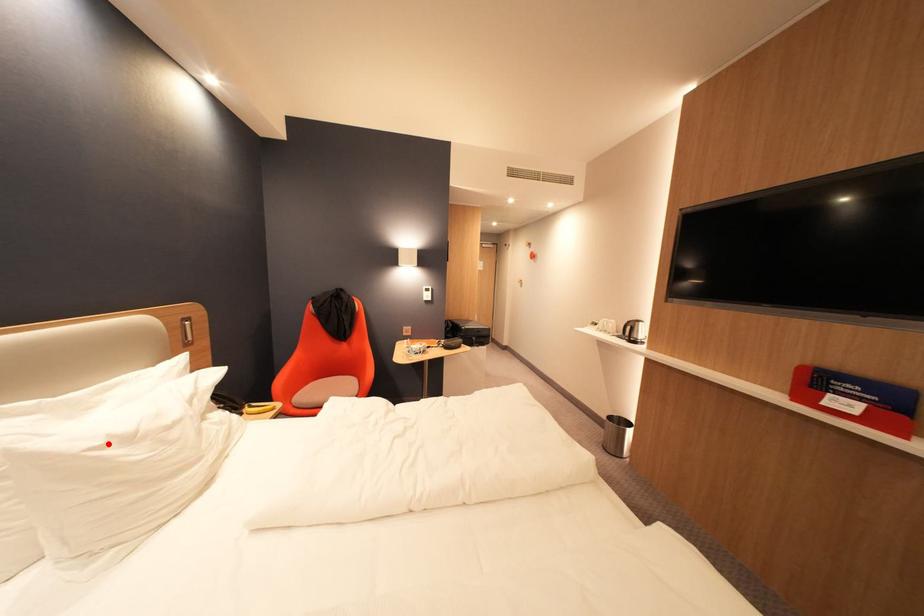
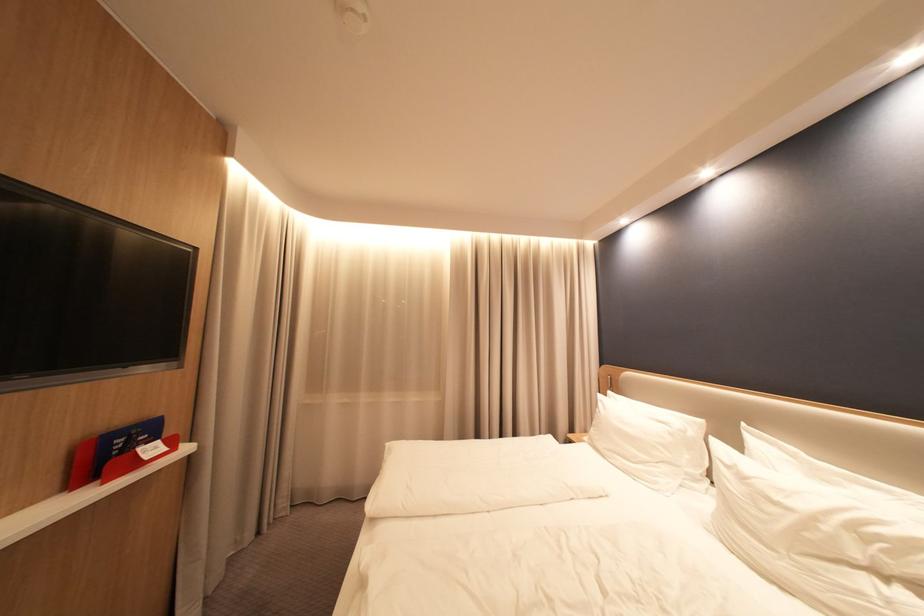
Where in the second image is the point corresponding to the highlighted location from the first image?

(737, 464)